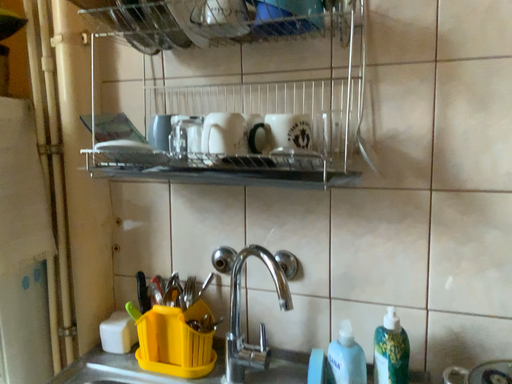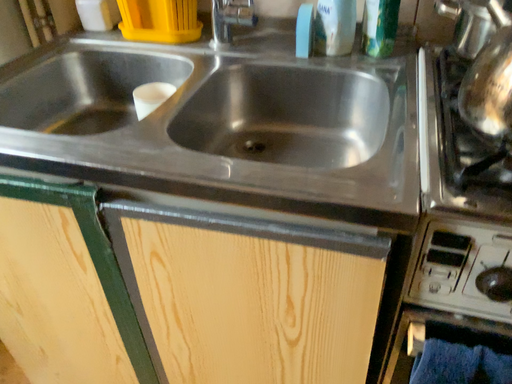
Question: Which way did the camera rotate in the video?

Choices:
 (A) rotated downward
 (B) rotated upward

Answer: (A)